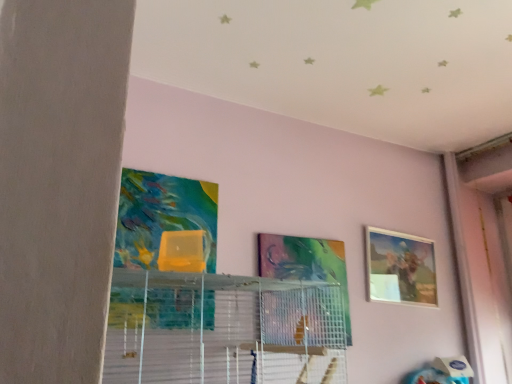
What do you see at coordinates (305, 263) in the screenshot? I see `metallic silver picture frame at center, which appears as the second picture frame when viewed from the right` at bounding box center [305, 263].

Find the location of a particular element. Image resolution: width=512 pixels, height=384 pixels. metallic silver picture frame at center, which is the first picture frame from front to back is located at coordinates (305, 263).

Find the location of a particular element. This screenshot has width=512, height=384. metallic silver picture frame at center, which is the first picture frame from front to back is located at coordinates coord(305,263).

In terms of height, does matte wooden picture frame at upper right, which appears as the 1th picture frame when viewed from the back, look taller or shorter compared to metallic silver picture frame at center, which appears as the 2th picture frame when viewed from the back?

matte wooden picture frame at upper right, which appears as the 1th picture frame when viewed from the back, is shorter than metallic silver picture frame at center, which appears as the 2th picture frame when viewed from the back.

From the picture: In terms of size, does matte wooden picture frame at upper right, which appears as the 1th picture frame when viewed from the back, appear bigger or smaller than metallic silver picture frame at center, which is the first picture frame from front to back?

Considering their sizes, matte wooden picture frame at upper right, which appears as the 1th picture frame when viewed from the back, takes up more space than metallic silver picture frame at center, which is the first picture frame from front to back.

From a real-world perspective, is matte wooden picture frame at upper right, which ranks as the second picture frame in front-to-back order, positioned over metallic silver picture frame at center, which appears as the second picture frame when viewed from the right, based on gravity?

Indeed, from a real-world perspective, matte wooden picture frame at upper right, which ranks as the second picture frame in front-to-back order, stands above metallic silver picture frame at center, which appears as the second picture frame when viewed from the right.

Does matte wooden picture frame at upper right, which appears as the 1th picture frame when viewed from the back, turn towards metallic silver picture frame at center, which appears as the 2th picture frame when viewed from the back?

No, matte wooden picture frame at upper right, which appears as the 1th picture frame when viewed from the back, is not turned towards metallic silver picture frame at center, which appears as the 2th picture frame when viewed from the back.

Is clear plastic shelf at center positioned far away from matte wooden picture frame at upper right, marked as the second picture frame in a left-to-right arrangement?

No, clear plastic shelf at center is in close proximity to matte wooden picture frame at upper right, marked as the second picture frame in a left-to-right arrangement.

Considering the relative sizes of clear plastic shelf at center and matte wooden picture frame at upper right, which appears as the 1th picture frame when viewed from the back, in the image provided, is clear plastic shelf at center smaller than matte wooden picture frame at upper right, which appears as the 1th picture frame when viewed from the back,?

No.

Is clear plastic shelf at center spatially inside matte wooden picture frame at upper right, which appears as the 1th picture frame when viewed from the back, or outside of it?

clear plastic shelf at center lies outside matte wooden picture frame at upper right, which appears as the 1th picture frame when viewed from the back.

From a real-world perspective, is clear plastic shelf at center on matte wooden picture frame at upper right, which appears as the 1th picture frame when viewed from the back?

No.

Is clear plastic shelf at center at the back of metallic silver picture frame at center, which is the first picture frame from front to back?

No.

From the image's perspective, which one is positioned higher, metallic silver picture frame at center, the first picture frame in the left-to-right sequence, or clear plastic shelf at center?

From the image's view, metallic silver picture frame at center, the first picture frame in the left-to-right sequence, is above.

Which point is more forward, (309, 280) or (116, 317)?

The point (116, 317) is more forward.

Is metallic silver picture frame at center, which appears as the 2th picture frame when viewed from the back, positioned behind clear plastic shelf at center?

Yes, metallic silver picture frame at center, which appears as the 2th picture frame when viewed from the back, is further from the viewer.

Can you see metallic silver picture frame at center, which is the first picture frame from front to back, touching matte wooden picture frame at upper right, marked as the second picture frame in a left-to-right arrangement?

No, metallic silver picture frame at center, which is the first picture frame from front to back, is not in contact with matte wooden picture frame at upper right, marked as the second picture frame in a left-to-right arrangement.

Based on the photo, is metallic silver picture frame at center, which appears as the second picture frame when viewed from the right, to the right of matte wooden picture frame at upper right, which appears as the 1th picture frame when viewed from the back, from the viewer's perspective?

Incorrect, metallic silver picture frame at center, which appears as the second picture frame when viewed from the right, is not on the right side of matte wooden picture frame at upper right, which appears as the 1th picture frame when viewed from the back.

Is metallic silver picture frame at center, which appears as the 2th picture frame when viewed from the back, outside of matte wooden picture frame at upper right, which appears as the 1th picture frame when viewed from the back?

Absolutely, metallic silver picture frame at center, which appears as the 2th picture frame when viewed from the back, is external to matte wooden picture frame at upper right, which appears as the 1th picture frame when viewed from the back.

Is clear plastic shelf at center located within matte wooden picture frame at upper right, which ranks as the second picture frame in front-to-back order?

No, clear plastic shelf at center is not a part of matte wooden picture frame at upper right, which ranks as the second picture frame in front-to-back order.

Looking at their sizes, would you say matte wooden picture frame at upper right, which appears as the 1th picture frame when viewed from the back, is wider or thinner than clear plastic shelf at center?

Considering their sizes, matte wooden picture frame at upper right, which appears as the 1th picture frame when viewed from the back, looks slimmer than clear plastic shelf at center.

Could you tell me if matte wooden picture frame at upper right, which ranks as the second picture frame in front-to-back order, is facing clear plastic shelf at center?

No, matte wooden picture frame at upper right, which ranks as the second picture frame in front-to-back order, is not turned towards clear plastic shelf at center.

Considering the relative sizes of matte wooden picture frame at upper right, which appears as the 1th picture frame when viewed from the back, and clear plastic shelf at center in the image provided, is matte wooden picture frame at upper right, which appears as the 1th picture frame when viewed from the back, bigger than clear plastic shelf at center?

Incorrect, matte wooden picture frame at upper right, which appears as the 1th picture frame when viewed from the back, is not larger than clear plastic shelf at center.

Based on the photo, considering the relative sizes of clear plastic shelf at center and metallic silver picture frame at center, which appears as the second picture frame when viewed from the right, in the image provided, is clear plastic shelf at center smaller than metallic silver picture frame at center, which appears as the second picture frame when viewed from the right,?

Actually, clear plastic shelf at center might be larger than metallic silver picture frame at center, which appears as the second picture frame when viewed from the right.

This screenshot has width=512, height=384. Identify the location of shelf in front of the metallic silver picture frame at center, which is the first picture frame from front to back. (222, 329).

How different are the orientations of clear plastic shelf at center and metallic silver picture frame at center, which is the first picture frame from front to back, in degrees?

There is a 4.47-degree angle between the facing directions of clear plastic shelf at center and metallic silver picture frame at center, which is the first picture frame from front to back.

Does clear plastic shelf at center lie behind metallic silver picture frame at center, which appears as the 2th picture frame when viewed from the back?

No.

Locate an element on the screen. This screenshot has height=384, width=512. picture frame below the matte wooden picture frame at upper right, which appears as the 1th picture frame when viewed from the back (from a real-world perspective) is located at coordinates click(x=305, y=263).

Locate an element on the screen. The height and width of the screenshot is (384, 512). the 2nd picture frame counting from the right side of the clear plastic shelf at center is located at coordinates coord(400,267).

When comparing their distances from metallic silver picture frame at center, which appears as the 2th picture frame when viewed from the back, does matte wooden picture frame at upper right, which is the first picture frame in right-to-left order, or clear plastic shelf at center seem further?

matte wooden picture frame at upper right, which is the first picture frame in right-to-left order.

Based on the photo, considering their positions, is clear plastic shelf at center positioned further to matte wooden picture frame at upper right, which is the first picture frame in right-to-left order, than metallic silver picture frame at center, the first picture frame in the left-to-right sequence?

clear plastic shelf at center.

From the image, which object appears to be farther from clear plastic shelf at center, metallic silver picture frame at center, the first picture frame in the left-to-right sequence, or matte wooden picture frame at upper right, which is the first picture frame in right-to-left order?

matte wooden picture frame at upper right, which is the first picture frame in right-to-left order, is further to clear plastic shelf at center.

Based on their spatial positions, is matte wooden picture frame at upper right, which is the first picture frame in right-to-left order, or metallic silver picture frame at center, which appears as the second picture frame when viewed from the right, further from clear plastic shelf at center?

matte wooden picture frame at upper right, which is the first picture frame in right-to-left order, is further to clear plastic shelf at center.

Estimate the real-world distances between objects in this image. Which object is closer to matte wooden picture frame at upper right, which ranks as the second picture frame in front-to-back order, metallic silver picture frame at center, the first picture frame in the left-to-right sequence, or clear plastic shelf at center?

metallic silver picture frame at center, the first picture frame in the left-to-right sequence.

When comparing their distances from metallic silver picture frame at center, which appears as the 2th picture frame when viewed from the back, does clear plastic shelf at center or matte wooden picture frame at upper right, which is the first picture frame in right-to-left order, seem closer?

clear plastic shelf at center is closer to metallic silver picture frame at center, which appears as the 2th picture frame when viewed from the back.

Locate an element on the screen. The width and height of the screenshot is (512, 384). picture frame between clear plastic shelf at center and matte wooden picture frame at upper right, marked as the second picture frame in a left-to-right arrangement, in the front-back direction is located at coordinates (305, 263).